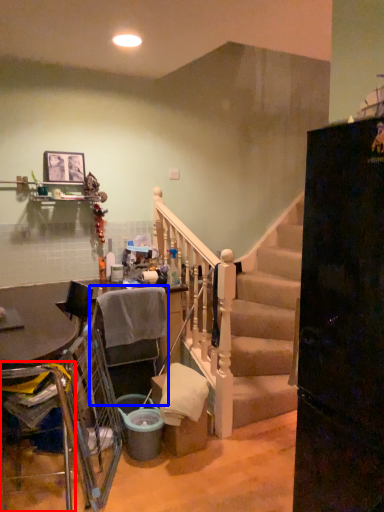
Question: Which object appears farthest to the camera in this image, armchair (highlighted by a red box) or armchair (highlighted by a blue box)?

Choices:
 (A) armchair
 (B) armchair

Answer: (B)